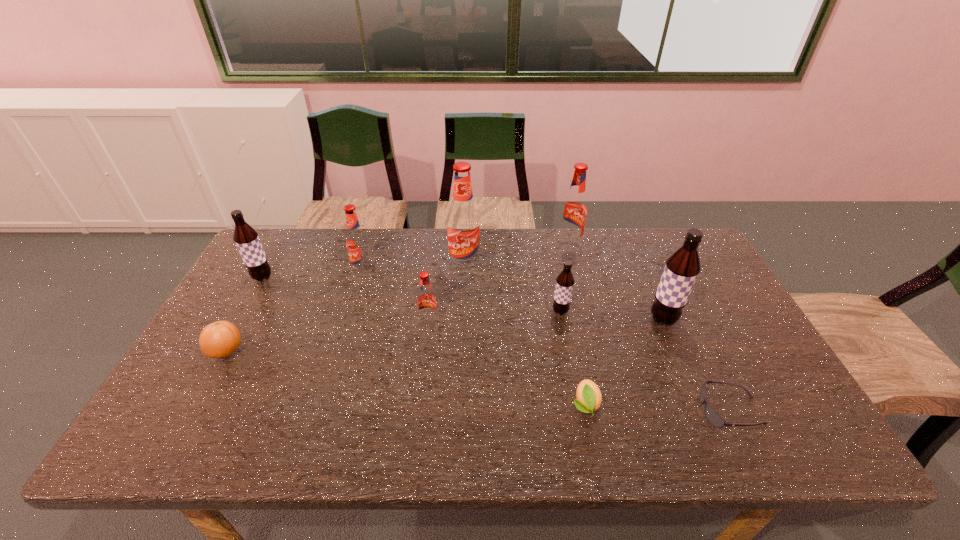
Locate an element on the screen. The width and height of the screenshot is (960, 540). empty space between the farthest root beer and the orange orange is located at coordinates (397, 298).

I want to click on free space between the seventh object from right to left and the third object from left to right, so click(396, 297).

I want to click on free space between the lemon and the rightmost root beer, so click(x=624, y=362).

Locate which object ranks in proximity to the sixth root beer from right to left. Please provide its 2D coordinates. Your answer should be formatted as a tuple, i.e. [(x, y)], where the tuple contains the x and y coordinates of a point satisfying the conditions above.

[(427, 305)]

Point out which object is positioned as the eighth nearest to the lemon. Please provide its 2D coordinates. Your answer should be formatted as a tuple, i.e. [(x, y)], where the tuple contains the x and y coordinates of a point satisfying the conditions above.

[(220, 339)]

Where is `the sixth closest root beer to the shortest object`? The width and height of the screenshot is (960, 540). the sixth closest root beer to the shortest object is located at coordinates (356, 240).

Locate an element on the screen. This screenshot has width=960, height=540. the fourth closest root beer to the biggest red root beer is located at coordinates pyautogui.click(x=574, y=209).

Identify the location of red root beer that is the third closest to the biggest red root beer. This screenshot has height=540, width=960. (574, 209).

The height and width of the screenshot is (540, 960). I want to click on red root beer object that ranks as the fourth closest to the biggest brown root beer, so click(356, 240).

Point out which brown root beer is positioned as the second nearest to the second biggest brown root beer. Please provide its 2D coordinates. Your answer should be formatted as a tuple, i.e. [(x, y)], where the tuple contains the x and y coordinates of a point satisfying the conditions above.

[(681, 270)]